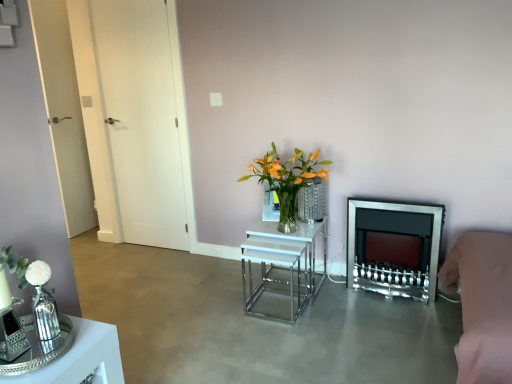
Question: Are white glossy nesting tables at center, placed as the 1th table when sorted from right to left, and white matte square at upper center located far from each other?

Choices:
 (A) no
 (B) yes

Answer: (B)

Question: From a real-world perspective, is white glossy nesting tables at center, placed as the 1th table when sorted from right to left, positioned under white matte square at upper center based on gravity?

Choices:
 (A) yes
 (B) no

Answer: (A)

Question: Can we say white glossy nesting tables at center, the first table viewed from the back, lies outside white matte square at upper center?

Choices:
 (A) yes
 (B) no

Answer: (A)

Question: From the image's perspective, does white glossy nesting tables at center, placed as the 2th table when sorted from left to right, appear higher than white matte square at upper center?

Choices:
 (A) no
 (B) yes

Answer: (A)

Question: Is white glossy nesting tables at center, the first table viewed from the back, behind white matte square at upper center?

Choices:
 (A) no
 (B) yes

Answer: (A)

Question: Considering the relative sizes of white glossy nesting tables at center, placed as the 2th table when sorted from left to right, and white matte square at upper center in the image provided, is white glossy nesting tables at center, placed as the 2th table when sorted from left to right, thinner than white matte square at upper center?

Choices:
 (A) no
 (B) yes

Answer: (A)

Question: Can you see shiny silver tray at lower left, the second table from the right, touching clear glass vase at center?

Choices:
 (A) no
 (B) yes

Answer: (A)

Question: Is shiny silver tray at lower left, the second table in the back-to-front sequence, wider than clear glass vase at center?

Choices:
 (A) no
 (B) yes

Answer: (B)

Question: From a real-world perspective, is shiny silver tray at lower left, which ranks as the 1th table in left-to-right order, positioned over clear glass vase at center based on gravity?

Choices:
 (A) no
 (B) yes

Answer: (A)

Question: Is shiny silver tray at lower left, the second table from the right, facing towards clear glass vase at center?

Choices:
 (A) yes
 (B) no

Answer: (B)

Question: Does shiny silver tray at lower left, the second table from the right, come behind clear glass vase at center?

Choices:
 (A) no
 (B) yes

Answer: (A)

Question: Does shiny silver tray at lower left, the second table in the back-to-front sequence, have a larger size compared to clear glass vase at center?

Choices:
 (A) no
 (B) yes

Answer: (A)

Question: Can you confirm if clear glass vase at center is thinner than shiny silver tray at lower left, the second table from the right?

Choices:
 (A) no
 (B) yes

Answer: (B)